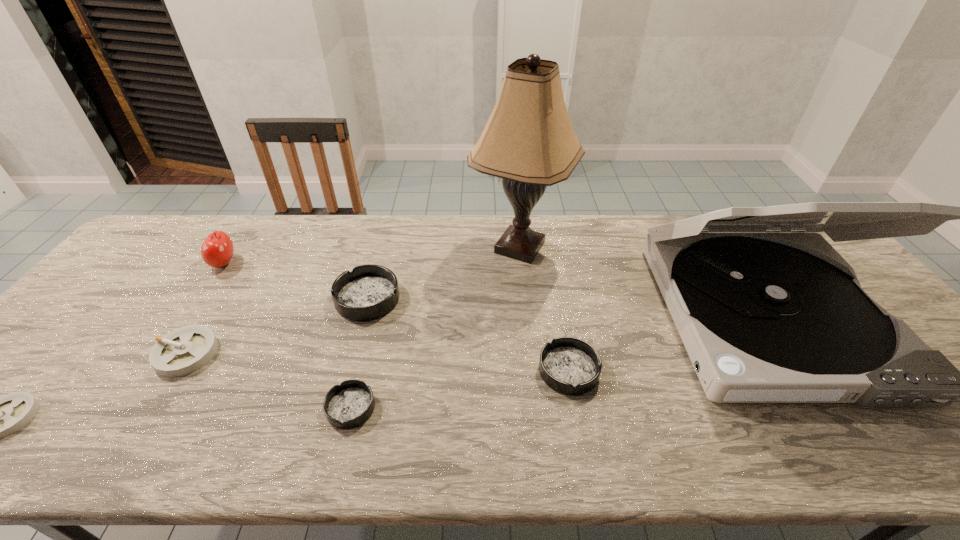
You are a GUI agent. You are given a task and a screenshot of the screen. Output one action in this format:
    pyautogui.click(x=<x>, y=<y>)
    Task: Click on the bigger gray ashtray
    
    Given the screenshot: What is the action you would take?
    pyautogui.click(x=185, y=350)

At what (x,y) coordinates should I click in order to perform the action: click on the smallest dark ashtray. Please return your answer as a coordinate pair (x, y). The height and width of the screenshot is (540, 960). Looking at the image, I should click on point(348,405).

Where is `free region located on the front of the tallest object`? free region located on the front of the tallest object is located at coordinates (532, 364).

Identify the location of free space located on the control panel of the rightmost object. The image size is (960, 540). (856, 451).

Locate an element on the screen. The image size is (960, 540). free space located on the back of the third tallest object is located at coordinates (238, 241).

Find the location of a particular element. The width and height of the screenshot is (960, 540). vacant space located on the back of the farthest dark ashtray is located at coordinates (382, 244).

Image resolution: width=960 pixels, height=540 pixels. I want to click on free space located 0.130m on the back of the rightmost dark ashtray, so click(x=558, y=309).

At what (x,y) coordinates should I click in order to perform the action: click on vacant space located on the back of the farther gray ashtray. Please return your answer as a coordinate pair (x, y). The image size is (960, 540). Looking at the image, I should click on (256, 240).

Where is `free space located 0.200m on the back of the smallest dark ashtray`? The image size is (960, 540). free space located 0.200m on the back of the smallest dark ashtray is located at coordinates (372, 323).

Find the location of a particular element. Image resolution: width=960 pixels, height=540 pixels. lamp present at the far edge is located at coordinates (528, 141).